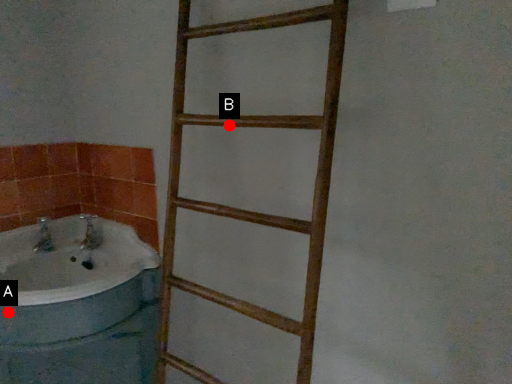
Question: Two points are circled on the image, labeled by A and B beside each circle. Which point is closer to the camera?

Choices:
 (A) A is closer
 (B) B is closer

Answer: (B)